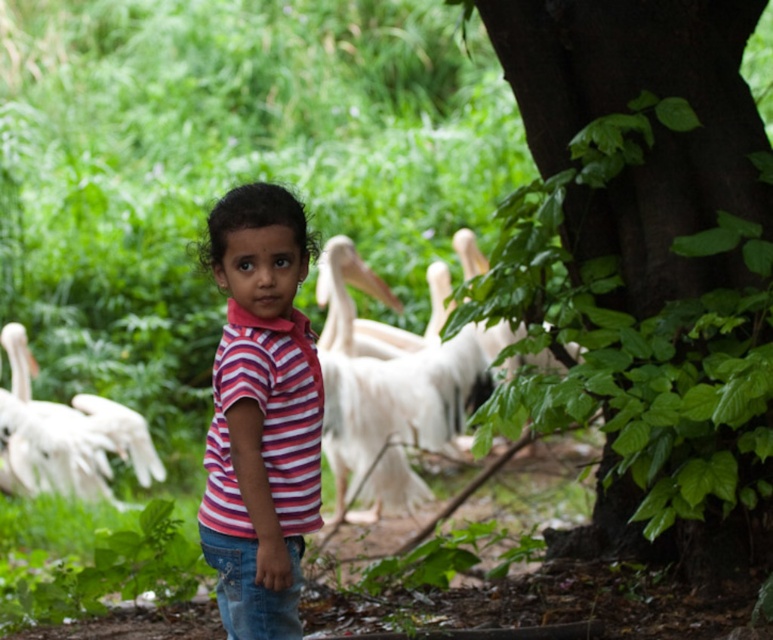
Does green leafy tree at center right have a smaller size compared to white feathered pelican at center?

No.

Which is more to the left, green leafy tree at center right or white feathered pelican at center?

Positioned to the left is white feathered pelican at center.

The image size is (773, 640). What do you see at coordinates (642, 268) in the screenshot?
I see `green leafy tree at center right` at bounding box center [642, 268].

The width and height of the screenshot is (773, 640). Identify the location of green leafy tree at center right. (642, 268).

Is pink striped shirt at center closer to the viewer compared to white feathered pelican at lower left?

Yes, it is in front of white feathered pelican at lower left.

Who is lower down, pink striped shirt at center or white feathered pelican at lower left?

Positioned lower is white feathered pelican at lower left.

Between point (237, 332) and point (60, 476), which one is positioned in front?

Positioned in front is point (237, 332).

Where is `pink striped shirt at center`? The width and height of the screenshot is (773, 640). pink striped shirt at center is located at coordinates (261, 413).

Is green leafy tree at center right smaller than white feathered pelican at lower left?

No, green leafy tree at center right is not smaller than white feathered pelican at lower left.

Can you confirm if green leafy tree at center right is thinner than white feathered pelican at lower left?

Incorrect, green leafy tree at center right's width is not less than white feathered pelican at lower left's.

Is point (739, 172) positioned behind point (5, 460)?

No, it is not.

Find the location of `green leafy tree at center right`. green leafy tree at center right is located at coordinates (642, 268).